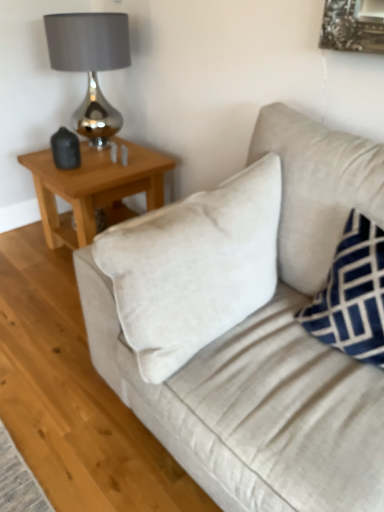
Question: Does beige fabric couch at center have a lesser width compared to shiny metallic lamp at upper left?

Choices:
 (A) yes
 (B) no

Answer: (B)

Question: Does beige fabric couch at center have a smaller size compared to shiny metallic lamp at upper left?

Choices:
 (A) no
 (B) yes

Answer: (A)

Question: Is beige fabric couch at center facing away from shiny metallic lamp at upper left?

Choices:
 (A) no
 (B) yes

Answer: (A)

Question: From the image's perspective, would you say beige fabric couch at center is positioned over shiny metallic lamp at upper left?

Choices:
 (A) no
 (B) yes

Answer: (A)

Question: Is the depth of beige fabric couch at center greater than that of shiny metallic lamp at upper left?

Choices:
 (A) yes
 (B) no

Answer: (B)

Question: Is beige fabric couch at center bigger than shiny metallic lamp at upper left?

Choices:
 (A) yes
 (B) no

Answer: (A)

Question: Is blue velvet pillow at right closer to the viewer compared to beige fabric couch at center?

Choices:
 (A) yes
 (B) no

Answer: (B)

Question: Is blue velvet pillow at right positioned behind beige fabric couch at center?

Choices:
 (A) no
 (B) yes

Answer: (B)

Question: Is blue velvet pillow at right at the left side of beige fabric couch at center?

Choices:
 (A) no
 (B) yes

Answer: (A)

Question: Is blue velvet pillow at right oriented towards beige fabric couch at center?

Choices:
 (A) no
 (B) yes

Answer: (B)

Question: From a real-world perspective, does blue velvet pillow at right sit lower than beige fabric couch at center?

Choices:
 (A) yes
 (B) no

Answer: (B)

Question: From the image's perspective, is blue velvet pillow at right below beige fabric couch at center?

Choices:
 (A) yes
 (B) no

Answer: (B)

Question: Can you confirm if light brown wooden table at upper left is smaller than beige fabric couch at center?

Choices:
 (A) no
 (B) yes

Answer: (B)